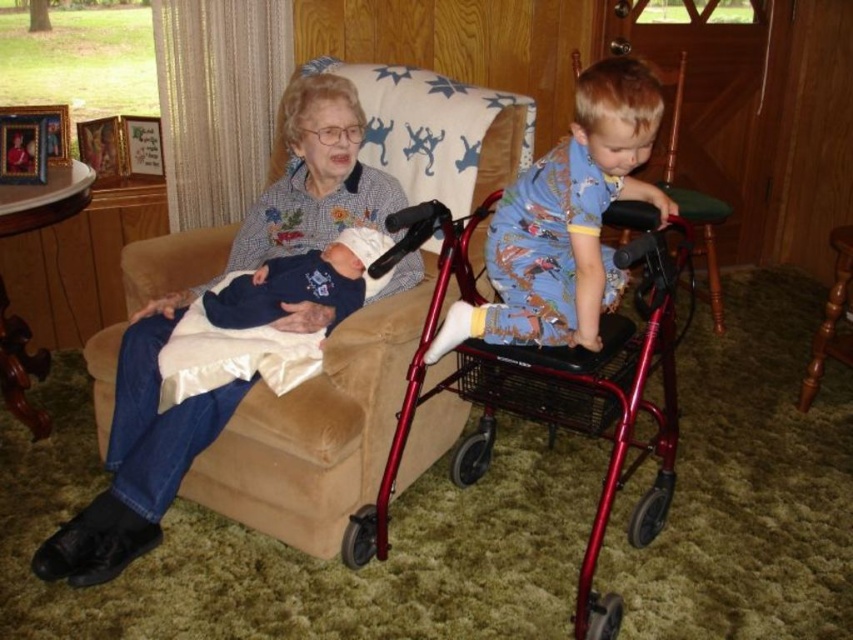
Question: Is matte blue shirt at center below blue cotton pajamas at center?

Choices:
 (A) no
 (B) yes

Answer: (B)

Question: Is metallic red walker at center to the left of blue cotton pajamas at center from the viewer's perspective?

Choices:
 (A) yes
 (B) no

Answer: (B)

Question: Estimate the real-world distances between objects in this image. Which object is closer to the blue cotton pajamas at center?

Choices:
 (A) matte blue shirt at center
 (B) metallic red walker at center
 (C) wooden chair at right

Answer: (B)

Question: Among these objects, which one is nearest to the camera?

Choices:
 (A) blue cotton pajamas at center
 (B) matte blue shirt at center
 (C) wooden chair at right
 (D) metallic red walker at center

Answer: (D)

Question: Where is matte blue shirt at center located in relation to blue cotton pajamas at center in the image?

Choices:
 (A) below
 (B) above

Answer: (A)

Question: Which of these objects is positioned farthest from the metallic red walker at center?

Choices:
 (A) blue cotton pajamas at center
 (B) matte blue shirt at center
 (C) wooden chair at right
 (D) dark blue fabric baby at center

Answer: (C)